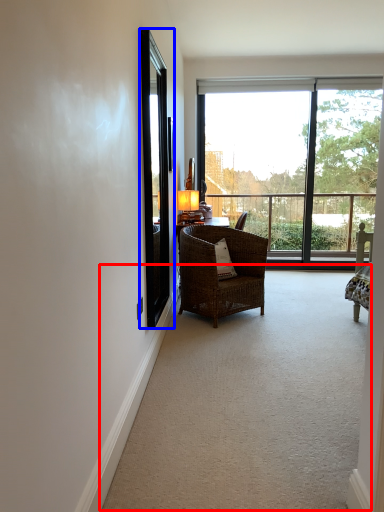
Question: Which of the following is the farthest to the observer, corridor (highlighted by a red box) or screen door (highlighted by a blue box)?

Choices:
 (A) corridor
 (B) screen door

Answer: (B)